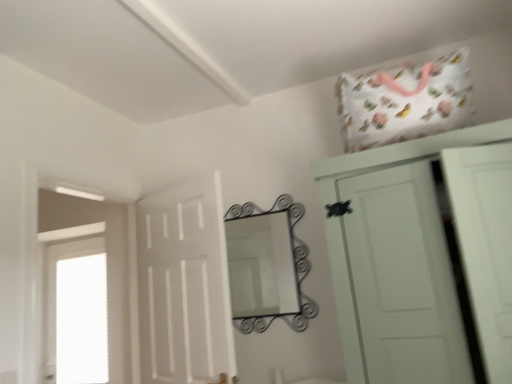
In order to click on white matte cupboard at upper right in this screenshot , I will do `click(402, 155)`.

Describe the element at coordinates (262, 266) in the screenshot. I see `metallic wrought iron mirror at center` at that location.

Where is `transparent glass window at left`? This screenshot has width=512, height=384. transparent glass window at left is located at coordinates (77, 313).

Considering the sizes of objects transparent glass window at left and white matte cupboard at upper right in the image provided, who is thinner, transparent glass window at left or white matte cupboard at upper right?

Thinner between the two is transparent glass window at left.

Who is more distant, transparent glass window at left or white matte cupboard at upper right?

transparent glass window at left is further away from the camera.

From a real-world perspective, is transparent glass window at left under white matte cupboard at upper right?

Yes, from a real-world perspective, transparent glass window at left is below white matte cupboard at upper right.

Could you tell me if transparent glass window at left is turned towards white matte cupboard at upper right?

No.

From the picture: From the image's perspective, relative to transparent glass window at left, is metallic wrought iron mirror at center above or below?

Clearly, from the image's perspective, metallic wrought iron mirror at center is above transparent glass window at left.

Which of these two, metallic wrought iron mirror at center or transparent glass window at left, is wider?

With larger width is transparent glass window at left.

Is metallic wrought iron mirror at center in front of transparent glass window at left?

Yes, metallic wrought iron mirror at center is closer to the camera.

Would you say metallic wrought iron mirror at center contains transparent glass window at left?

No, transparent glass window at left is located outside of metallic wrought iron mirror at center.

Would you say white matte door at center is outside transparent glass window at left?

Absolutely, white matte door at center is external to transparent glass window at left.

Which object is further away from the camera, white matte door at center or transparent glass window at left?

Positioned behind is transparent glass window at left.

Between white matte door at center and transparent glass window at left, which one appears on the left side from the viewer's perspective?

From the viewer's perspective, transparent glass window at left appears more on the left side.

In terms of height, does white matte door at center look taller or shorter compared to transparent glass window at left?

In the image, white matte door at center appears to be shorter than transparent glass window at left.

From the image's perspective, does transparent glass window at left appear lower than metallic wrought iron mirror at center?

Indeed, from the image's perspective, transparent glass window at left is shown beneath metallic wrought iron mirror at center.

Is transparent glass window at left next to metallic wrought iron mirror at center and touching it?

No, transparent glass window at left is not with metallic wrought iron mirror at center.

From a real-world perspective, is transparent glass window at left positioned under metallic wrought iron mirror at center based on gravity?

Yes.

Which object is wider, transparent glass window at left or white matte door at center?

With larger width is white matte door at center.

Considering the sizes of objects transparent glass window at left and white matte door at center in the image provided, who is smaller, transparent glass window at left or white matte door at center?

Smaller between the two is transparent glass window at left.

Which point is more forward, (88, 259) or (224, 310)?

The point (224, 310) is more forward.

Is transparent glass window at left shorter than white matte door at center?

No.

Which of these two, metallic wrought iron mirror at center or white matte cupboard at upper right, stands taller?

Standing taller between the two is white matte cupboard at upper right.

Measure the distance from metallic wrought iron mirror at center to white matte cupboard at upper right.

metallic wrought iron mirror at center and white matte cupboard at upper right are 37.41 inches apart.

From the picture: Based on their sizes in the image, would you say metallic wrought iron mirror at center is bigger or smaller than white matte cupboard at upper right?

Clearly, metallic wrought iron mirror at center is smaller in size than white matte cupboard at upper right.

Which object is wider, metallic wrought iron mirror at center or white matte cupboard at upper right?

With larger width is white matte cupboard at upper right.

Is white matte cupboard at upper right located outside transparent glass window at left?

Yes.

From the picture: From the image's perspective, which is above, white matte cupboard at upper right or transparent glass window at left?

white matte cupboard at upper right is shown above in the image.

Which is more to the right, white matte cupboard at upper right or transparent glass window at left?

white matte cupboard at upper right.

From a real-world perspective, between white matte cupboard at upper right and transparent glass window at left, who is vertically higher?

white matte cupboard at upper right is physically above.

This screenshot has width=512, height=384. Identify the location of window below the white matte cupboard at upper right (from the image's perspective). (77, 313).

At what (x,y) coordinates should I click in order to perform the action: click on mirror that appears on the right of transparent glass window at left. Please return your answer as a coordinate pair (x, y). Looking at the image, I should click on (262, 266).

Estimate the real-world distances between objects in this image. Which object is closer to white matte door at center, white matte cupboard at upper right or transparent glass window at left?

Among the two, white matte cupboard at upper right is located nearer to white matte door at center.

Based on their spatial positions, is transparent glass window at left or white matte cupboard at upper right closer to white matte door at center?

white matte cupboard at upper right is positioned closer to the anchor white matte door at center.

Looking at the image, which one is located further to transparent glass window at left, metallic wrought iron mirror at center or white matte cupboard at upper right?

white matte cupboard at upper right lies further to transparent glass window at left than the other object.

Based on their spatial positions, is white matte cupboard at upper right or white matte door at center further from metallic wrought iron mirror at center?

white matte cupboard at upper right lies further to metallic wrought iron mirror at center than the other object.

Estimate the real-world distances between objects in this image. Which object is closer to white matte cupboard at upper right, metallic wrought iron mirror at center or transparent glass window at left?

metallic wrought iron mirror at center.

From the image, which object appears to be farther from white matte door at center, metallic wrought iron mirror at center or transparent glass window at left?

The object further to white matte door at center is transparent glass window at left.

From the image, which object appears to be nearer to metallic wrought iron mirror at center, white matte door at center or transparent glass window at left?

white matte door at center.

Consider the image. When comparing their distances from transparent glass window at left, does metallic wrought iron mirror at center or white matte door at center seem further?

Among the two, metallic wrought iron mirror at center is located further to transparent glass window at left.

Locate an element on the screen. mirror between transparent glass window at left and white matte cupboard at upper right is located at coordinates (262, 266).

The image size is (512, 384). I want to click on door located between transparent glass window at left and metallic wrought iron mirror at center in the left-right direction, so click(x=184, y=285).

Where is `door between transparent glass window at left and white matte cupboard at upper right from left to right`? The height and width of the screenshot is (384, 512). door between transparent glass window at left and white matte cupboard at upper right from left to right is located at coordinates (184, 285).

The width and height of the screenshot is (512, 384). I want to click on mirror situated between white matte door at center and white matte cupboard at upper right from left to right, so click(262, 266).